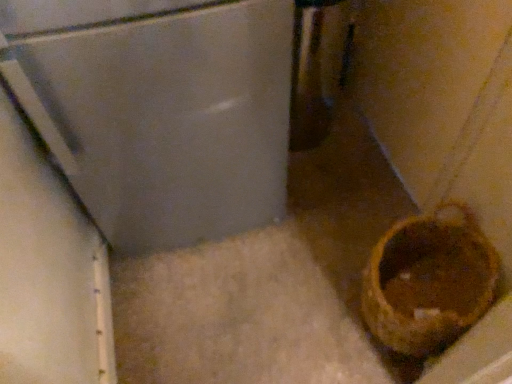
What is the approximate width of rustic woven basket at lower right?

rustic woven basket at lower right is 36.85 centimeters wide.

Describe the element at coordinates (428, 281) in the screenshot. I see `rustic woven basket at lower right` at that location.

Identify the location of rustic woven basket at lower right. (428, 281).

The width and height of the screenshot is (512, 384). I want to click on rustic woven basket at lower right, so click(428, 281).